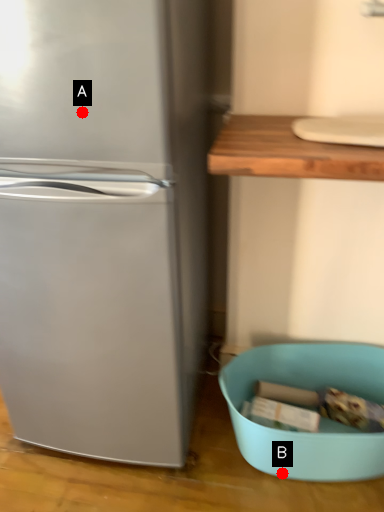
Question: Two points are circled on the image, labeled by A and B beside each circle. Among these points, which one is farthest from the camera?

Choices:
 (A) A is further
 (B) B is further

Answer: (B)